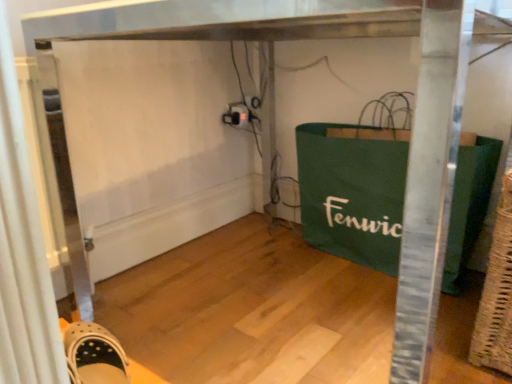
The width and height of the screenshot is (512, 384). In order to click on vacant space positioned to the left of green paper bag at center in this screenshot , I will do `click(271, 294)`.